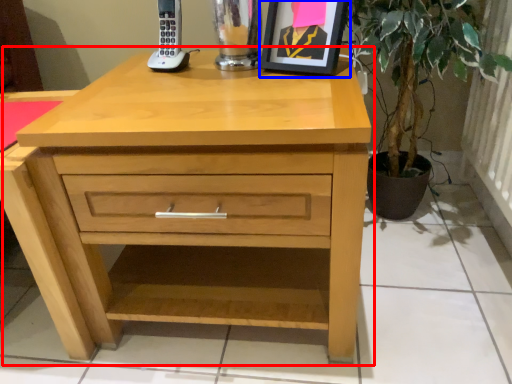
Question: Which object appears closest to the camera in this image, chest of drawers (highlighted by a red box) or picture frame (highlighted by a blue box)?

Choices:
 (A) chest of drawers
 (B) picture frame

Answer: (A)